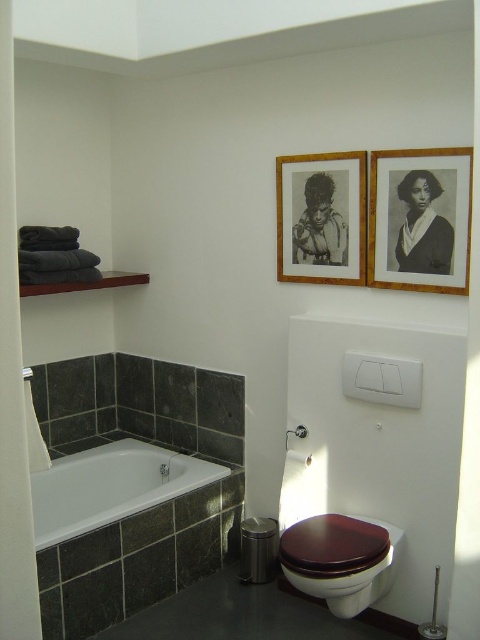
You are designing a layout for a bathroom and want to ensure that the wooden picture frame at upper center and the brushed metal shower at lower left are spaced appropriately. Based on their widths, which object requires more horizontal space?

The wooden picture frame at upper center might require more horizontal space than the brushed metal shower at lower left since it might be wider.

You are standing in the bathroom and want to reach both the toilet paper roll and the trash can. The toilet paper roll is located at point [286,186] and the trash can is at point [288,445]. Which object will you reach first as you move forward?

You will reach the toilet paper roll at point [286,186] first because it is closer to you than the trash can at point [288,445].